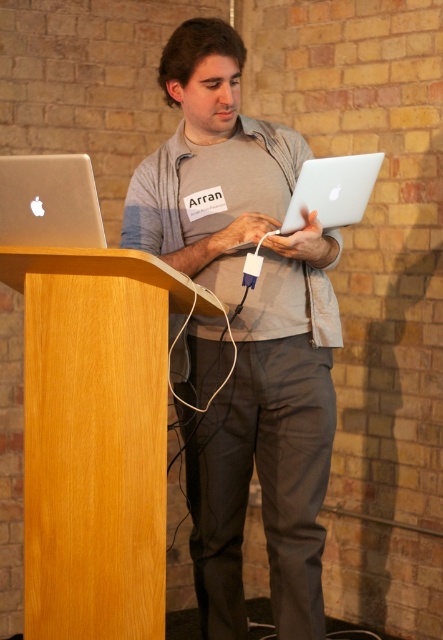
Question: Can you confirm if wooden podium at left is positioned above silver metallic laptop at left?

Choices:
 (A) yes
 (B) no

Answer: (B)

Question: Which object is farther from the camera taking this photo?

Choices:
 (A) matte gray laptop at center
 (B) sleek silver laptop at center
 (C) wooden podium at left
 (D) silver metallic laptop at left

Answer: (A)

Question: Does matte gray laptop at center have a greater width compared to silver metallic laptop at left?

Choices:
 (A) yes
 (B) no

Answer: (A)

Question: Where is silver metallic laptop at left located in relation to sleek silver laptop at center in the image?

Choices:
 (A) right
 (B) left

Answer: (B)

Question: Which object appears farthest from the camera in this image?

Choices:
 (A) sleek silver laptop at center
 (B) matte gray laptop at center

Answer: (B)

Question: Based on their relative distances, which object is farther from the wooden podium at left?

Choices:
 (A) matte gray laptop at center
 (B) silver metallic laptop at left
 (C) sleek silver laptop at center

Answer: (C)